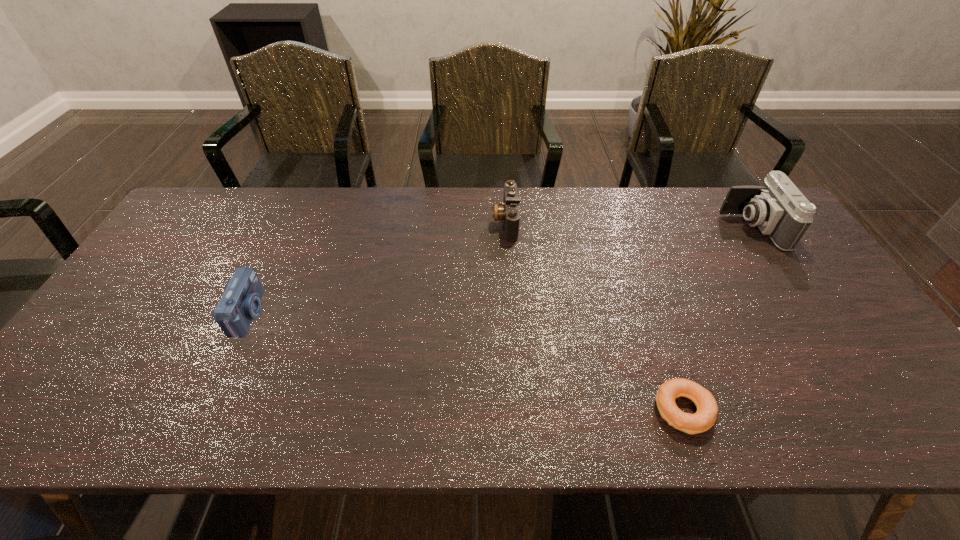
In order to click on the tallest object in this screenshot , I will do `click(778, 208)`.

Locate an element on the screen. the rightmost object is located at coordinates (778, 208).

At what (x,y) coordinates should I click in order to perform the action: click on the third object from right to left. Please return your answer as a coordinate pair (x, y). The width and height of the screenshot is (960, 540). Looking at the image, I should click on (509, 212).

Find the location of a particular element. the nearest camera is located at coordinates (240, 303).

The image size is (960, 540). I want to click on the leftmost camera, so click(x=240, y=303).

What are the coordinates of `the shortest object` in the screenshot? It's located at (707, 409).

Where is `the nearest object`? This screenshot has width=960, height=540. the nearest object is located at coordinates (707, 409).

I want to click on vacant area situated 0.220m at the front of the rightmost object with an open lens cover, so click(656, 228).

The width and height of the screenshot is (960, 540). I want to click on vacant area situated at the front of the rightmost object with an open lens cover, so click(687, 228).

You are a GUI agent. You are given a task and a screenshot of the screen. Output one action in this format:
    pyautogui.click(x=<x>, y=<y>)
    Task: Click on the vacant space located 0.100m at the front of the rightmost object with an open lens cover
    This screenshot has width=960, height=540.
    Given the screenshot: What is the action you would take?
    pyautogui.click(x=693, y=228)